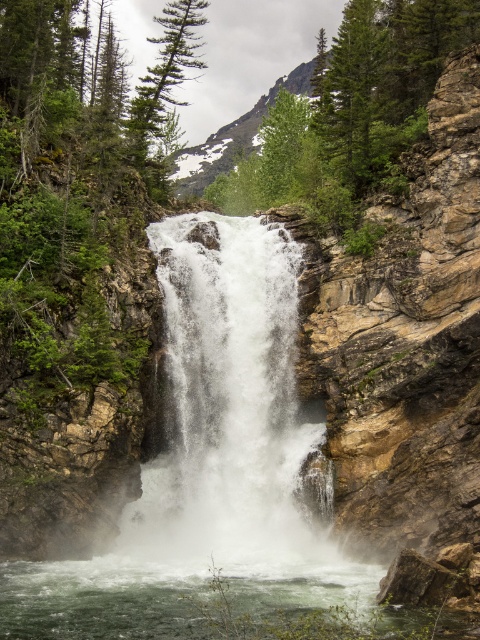
You are standing at the edge of the waterfall and see the point marked at coordinates point (228, 410). What is located at that point?

The point (228, 410) marks white frothy water at center.

You are a hiker standing at the edge of the waterfall. You see the white frothy water at center and the green frothy water at lower center. Which one is higher up the waterfall?

The white frothy water at center is located above the green frothy water at lower center, so the white frothy water at center is higher up the waterfall.